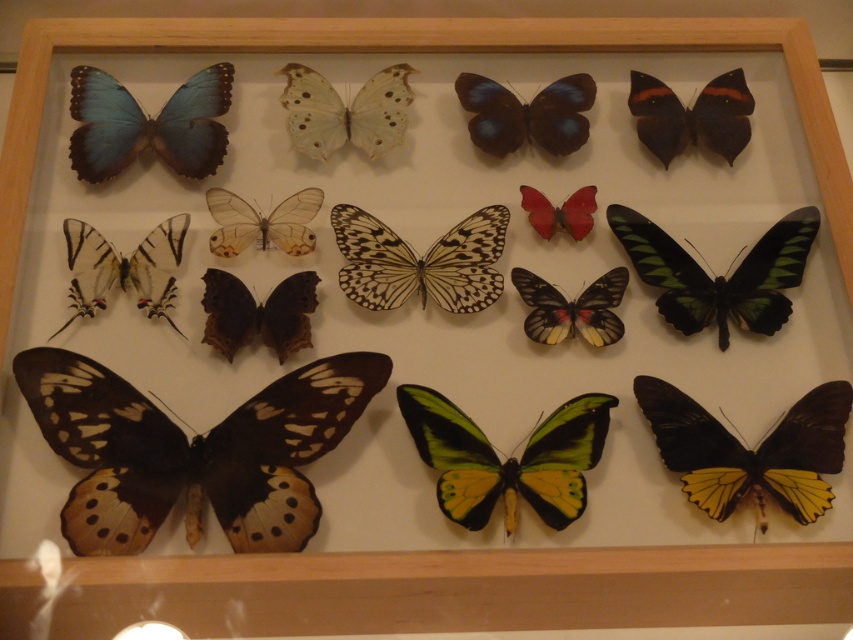
From the picture: You are a curator examining the display case of butterflies. You notice two points marked in the image, point 1 at coordinates point (355, 124) and point 2 at coordinates point (556, 209). Which point is closer to the front of the display case?

Point (556, 209) is closer to the front of the display case because it is in front of point (355, 124).